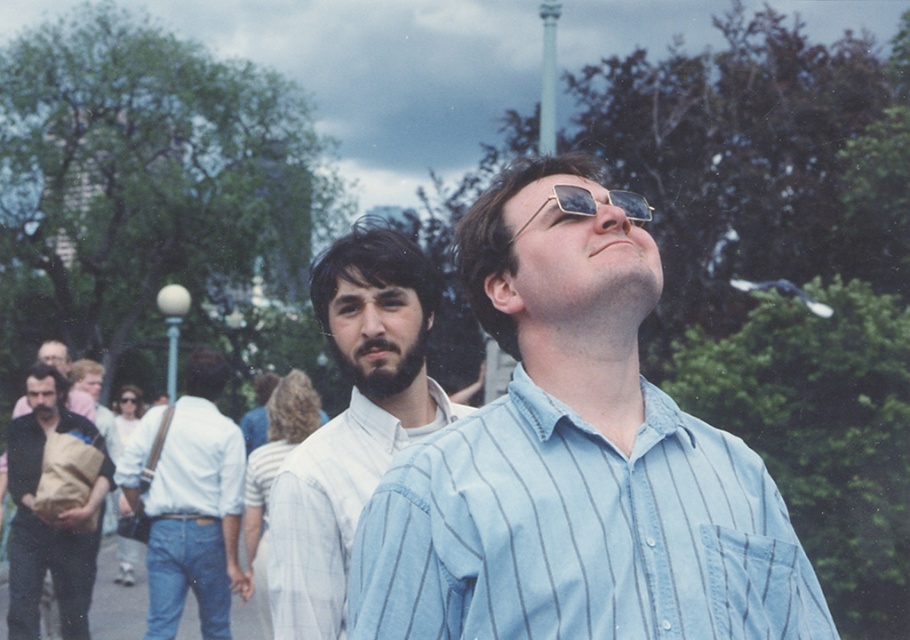
You are a photographer standing in the park and want to take a photo of the white shirt at center and the brown paper bag at left. Which object is positioned closer to you?

The white shirt at center is closer to the viewer than the brown paper bag at left.

You are a photographer trying to capture both the white cotton shirt at center and the brown paper bag at left in a single shot. Based on their positions, which object should you adjust your camera to focus on first to ensure both are in frame?

The white cotton shirt at center is to the right of the brown paper bag at left. To include both in the frame, focus on the brown paper bag at left first since it is on the left side, then adjust the camera to include the white cotton shirt at center on the right.

You are a photographer trying to capture both the white shirt at center and the brown paper bag at left in the same frame. Since you want to ensure both are visible, which object should you focus on to account for their sizes?

The white shirt at center has a lesser width compared to brown paper bag at left, so you should focus on the brown paper bag at left since it is larger and requires more attention to capture its details properly.